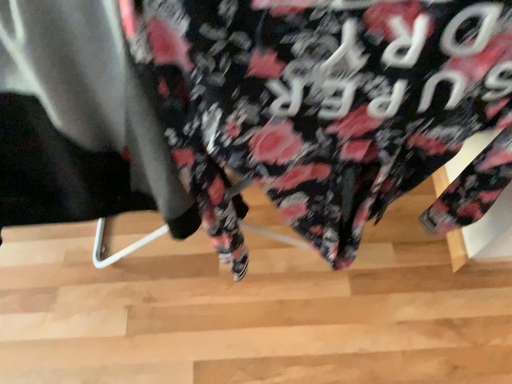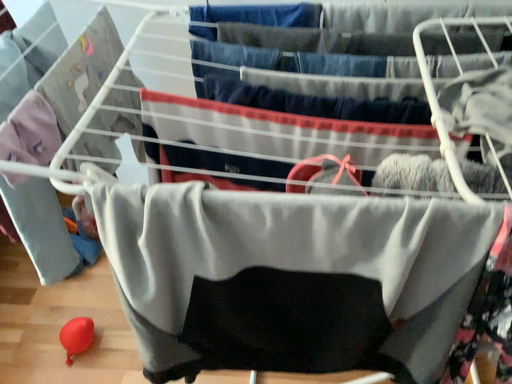
Question: Which way did the camera rotate in the video?

Choices:
 (A) rotated downward
 (B) rotated upward

Answer: (B)